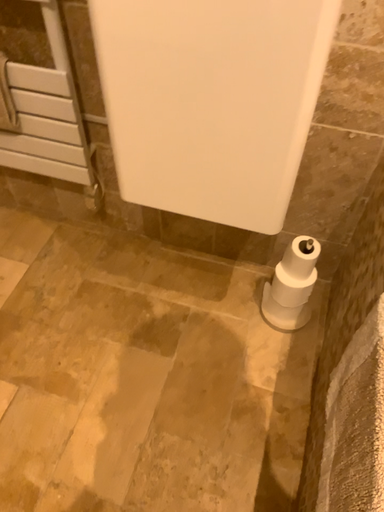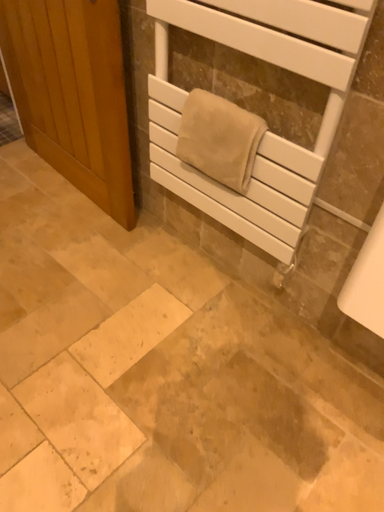
Question: How did the camera likely rotate when shooting the video?

Choices:
 (A) rotated right
 (B) rotated left

Answer: (B)